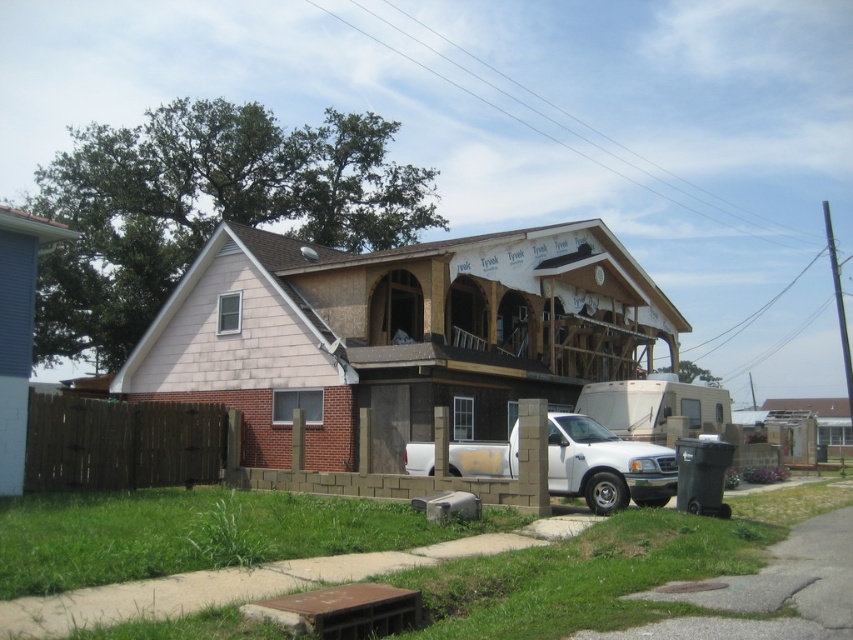
You are standing on the sidewalk in front of the house and want to walk to the white matte truck at center. Which direction should you move relative to the wooden frame house at center?

Since the wooden frame house at center is closer to you than the white matte truck at center, you should move away from the wooden frame house at center to reach the white matte truck at center.

You are a delivery driver arriving at the residential area to unload a package. You see the wooden frame house at center and the white matte truck at center. Which object is taller?

The wooden frame house at center has a greater height compared to the white matte truck at center, so the wooden frame house at center is taller.